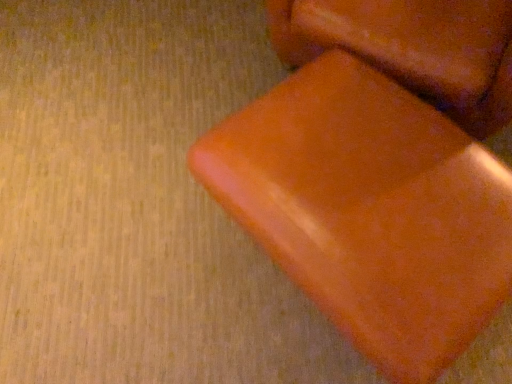
Where is `vacant space positioned to the left of orange matte bean bag chair at center`? This screenshot has width=512, height=384. vacant space positioned to the left of orange matte bean bag chair at center is located at coordinates (141, 233).